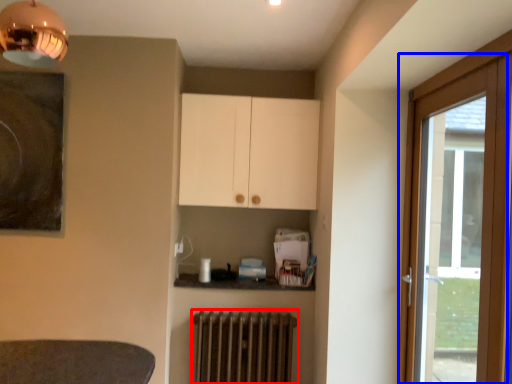
Question: Among these objects, which one is nearest to the camera, radiator (highlighted by a red box) or door (highlighted by a blue box)?

Choices:
 (A) radiator
 (B) door

Answer: (B)